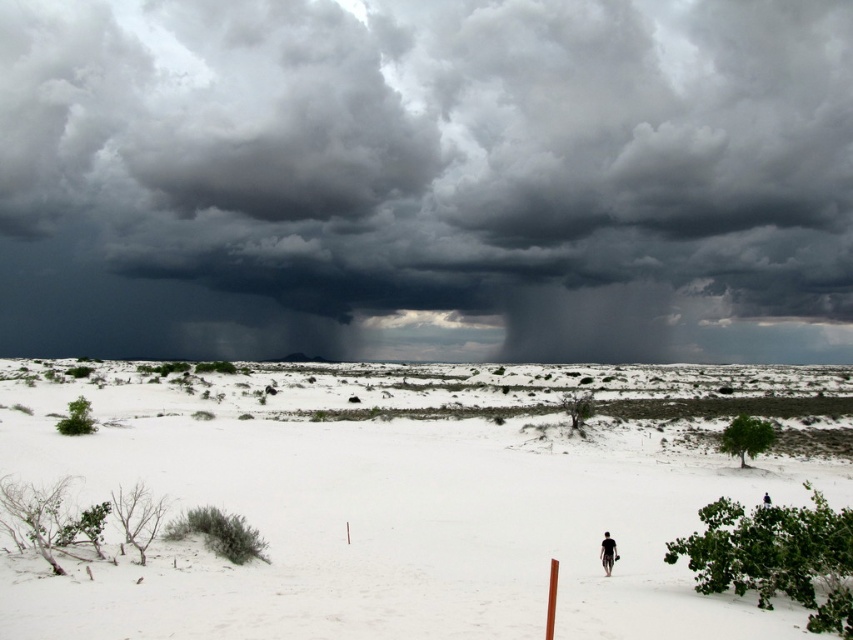
Question: Among these objects, which one is nearest to the camera?

Choices:
 (A) white sand plain at center
 (B) dark gray cloud at upper center
 (C) black matte person at lower center

Answer: (A)

Question: Among these points, which one is nearest to the camera?

Choices:
 (A) (105, 346)
 (B) (93, 579)

Answer: (B)

Question: Is dark gray cloud at upper center bigger than black matte person at lower center?

Choices:
 (A) no
 (B) yes

Answer: (B)

Question: Is white sand plain at center below black matte person at lower center?

Choices:
 (A) no
 (B) yes

Answer: (B)

Question: Among these objects, which one is farthest from the camera?

Choices:
 (A) dark gray cloud at upper center
 (B) black matte person at lower center

Answer: (A)

Question: Can you confirm if dark gray cloud at upper center is thinner than black matte person at lower center?

Choices:
 (A) no
 (B) yes

Answer: (A)